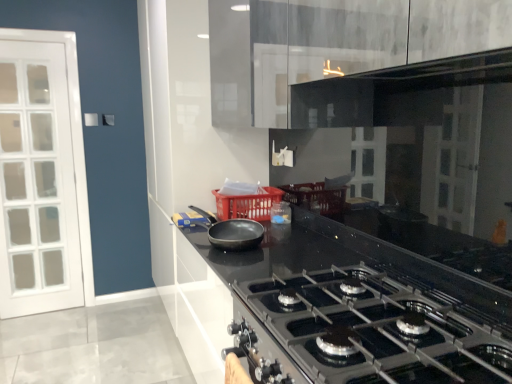
Question: Does matte black pan at center have a lesser height compared to translucent plastic container at center?

Choices:
 (A) yes
 (B) no

Answer: (A)

Question: Does matte black pan at center touch translucent plastic container at center?

Choices:
 (A) yes
 (B) no

Answer: (B)

Question: Considering the relative positions of matte black pan at center and translucent plastic container at center in the image provided, is matte black pan at center in front of translucent plastic container at center?

Choices:
 (A) no
 (B) yes

Answer: (B)

Question: Is matte black pan at center at the left side of translucent plastic container at center?

Choices:
 (A) no
 (B) yes

Answer: (B)

Question: Is matte black pan at center smaller than translucent plastic container at center?

Choices:
 (A) yes
 (B) no

Answer: (B)

Question: From a real-world perspective, relative to black glossy countertop at center, is matte black pan at center vertically above or below?

Choices:
 (A) above
 (B) below

Answer: (A)

Question: Choose the correct answer: Is matte black pan at center inside black glossy countertop at center or outside it?

Choices:
 (A) outside
 (B) inside

Answer: (A)

Question: Based on their positions, is matte black pan at center located to the left or right of black glossy countertop at center?

Choices:
 (A) right
 (B) left

Answer: (B)

Question: Based on their sizes in the image, would you say matte black pan at center is bigger or smaller than black glossy countertop at center?

Choices:
 (A) small
 (B) big

Answer: (A)

Question: Would you say red plastic basket at center is inside or outside translucent plastic container at center?

Choices:
 (A) outside
 (B) inside

Answer: (A)

Question: Considering the positions of red plastic basket at center and translucent plastic container at center in the image, is red plastic basket at center wider or thinner than translucent plastic container at center?

Choices:
 (A) wide
 (B) thin

Answer: (A)

Question: In the image, is red plastic basket at center positioned in front of or behind translucent plastic container at center?

Choices:
 (A) behind
 (B) front

Answer: (B)

Question: From the image's perspective, relative to translucent plastic container at center, is red plastic basket at center above or below?

Choices:
 (A) below
 (B) above

Answer: (B)

Question: From a real-world perspective, relative to matte black pan at center, is black glossy countertop at center vertically above or below?

Choices:
 (A) above
 (B) below

Answer: (B)

Question: Is black glossy countertop at center in front of or behind matte black pan at center in the image?

Choices:
 (A) front
 (B) behind

Answer: (A)